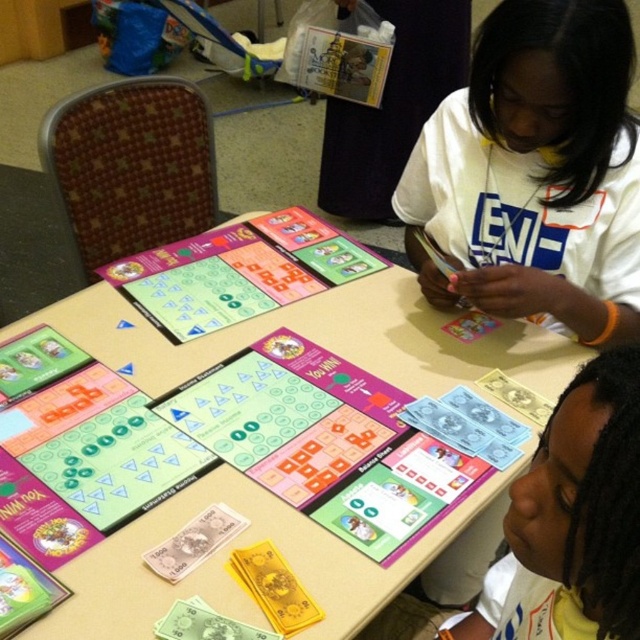
You are a game piece that needs to move from the cardboard game board at center to the white matte shirt at upper right. Can you reach the shirt without passing behind it?

The cardboard game board at center is in front of the white matte shirt at upper right, so you can reach the shirt without passing behind it by moving around the board.

You are standing at the edge of the table where the board game is set up. You need to place a new game piece exactly at the point marked as point (250, 428). According to the scene description, where should you place the new game piece?

The point (250, 428) corresponds to the cardboard game board at center, so you should place the new game piece on the cardboard game board at center.

You are a game designer observing the scene. You need to determine if the cardboard game board at center will fit into a storage box designed for items no taller than the white matte shirt at upper right. Can it fit?

The cardboard game board at center is much taller than the white matte shirt at upper right, so it will not fit into the storage box designed for items no taller than the white matte shirt at upper right.